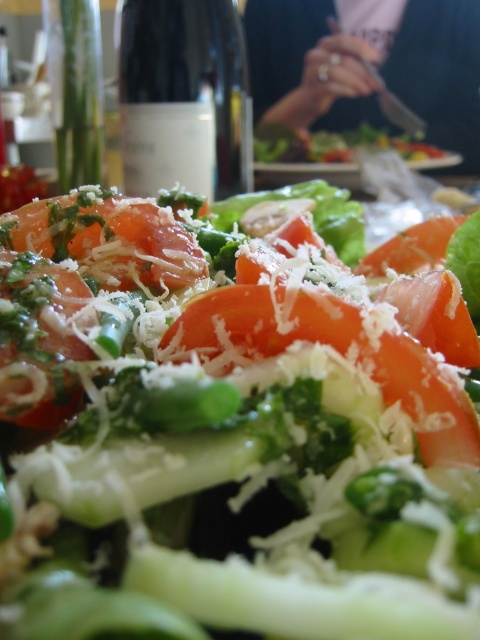
Question: Is shiny green salad at center positioned before tomato with grated cheese at center?

Choices:
 (A) yes
 (B) no

Answer: (A)

Question: Which point is closer to the camera?

Choices:
 (A) tomato with grated cheese at center
 (B) shiny orange tomato at center
 (C) clear glass bottle at upper center
 (D) tomato with green herbs and grated cheese at center

Answer: (A)

Question: Which object appears farthest from the camera in this image?

Choices:
 (A) tomato with green herbs and grated cheese at center
 (B) shiny orange tomato at center

Answer: (B)

Question: Which object is positioned farthest from the tomato with grated cheese at center?

Choices:
 (A) clear glass bottle at upper center
 (B) shiny orange tomato at center
 (C) shiny green salad at center
 (D) tomato with green herbs and grated cheese at center

Answer: (A)

Question: Does tomato with grated cheese at center have a lesser width compared to tomato with green herbs and grated cheese at center?

Choices:
 (A) yes
 (B) no

Answer: (B)

Question: Is shiny green salad at center to the right of shiny orange tomato at center from the viewer's perspective?

Choices:
 (A) yes
 (B) no

Answer: (A)